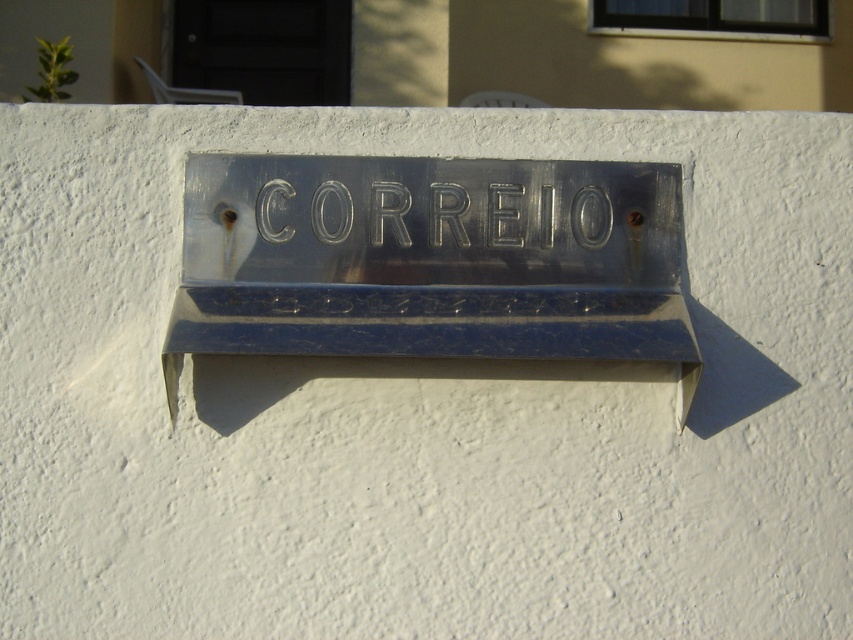
You are standing in front of the metallic mailbox on the white wall. There are two points marked on the wall at coordinates point (253, 273) and point (608, 227). If you want to place a sticker closer to you, which point should you choose?

Point (253, 273) is closer to the viewer than point (608, 227), so you should choose point (253, 273) to place the sticker closer to you.

You have a small package that is 3 inches wide. You want to place it into the mailbox. The slot for inserting mail is between the metallic blue mailbox at center and the metallic embossed letters at center. Can the package fit through the slot?

The distance between the metallic blue mailbox at center and the metallic embossed letters at center is 2.41 inches. Since the package is 3 inches wide, it cannot fit through the slot.

You are a delivery person who needs to place a parcel into the mailbox. The parcel has a height of 10 cm. The coordinates of the parcel are at point 0.408, 0.506. Is the parcel overlapping with the metallic blue mailbox at center?

The parcel is at the same coordinates as the metallic blue mailbox at center, so yes, the parcel is overlapping with the metallic blue mailbox at center.